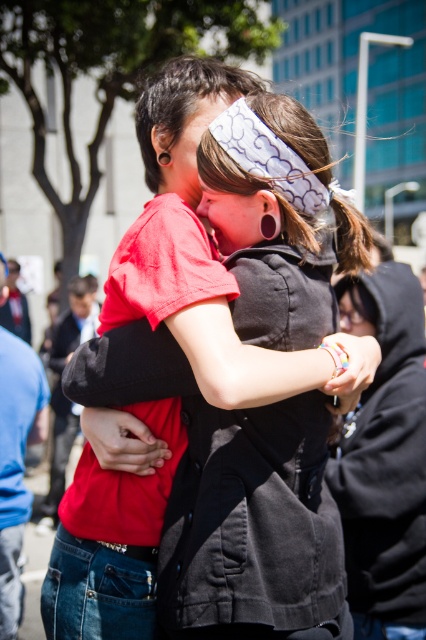
Can you confirm if white printed fabric headband at center is positioned above matte red shirt at center?

Yes, white printed fabric headband at center is above matte red shirt at center.

Looking at this image, is white printed fabric headband at center smaller than matte red shirt at center?

No, white printed fabric headband at center is not smaller than matte red shirt at center.

Image resolution: width=426 pixels, height=640 pixels. Describe the element at coordinates (267, 157) in the screenshot. I see `white printed fabric headband at center` at that location.

Locate an element on the screen. The height and width of the screenshot is (640, 426). white printed fabric headband at center is located at coordinates [267, 157].

Is matte red shirt at center shorter than matte black face at center?

Yes.

Does matte red shirt at center appear under matte black face at center?

Actually, matte red shirt at center is above matte black face at center.

Who is more distant from viewer, (238, 225) or (373, 323)?

The point (373, 323) is more distant.

The image size is (426, 640). In order to click on matte red shirt at center in this screenshot , I will do `click(233, 216)`.

Is white printed fabric headband at center smaller than matte black face at center?

No.

Can you confirm if white printed fabric headband at center is positioned below matte black face at center?

No.

Does point (236, 157) come closer to viewer compared to point (356, 285)?

That is True.

You are a GUI agent. You are given a task and a screenshot of the screen. Output one action in this format:
    pyautogui.click(x=<x>, y=<y>)
    Task: Click on the white printed fabric headband at center
    The image size is (426, 640).
    Given the screenshot: What is the action you would take?
    pyautogui.click(x=267, y=157)